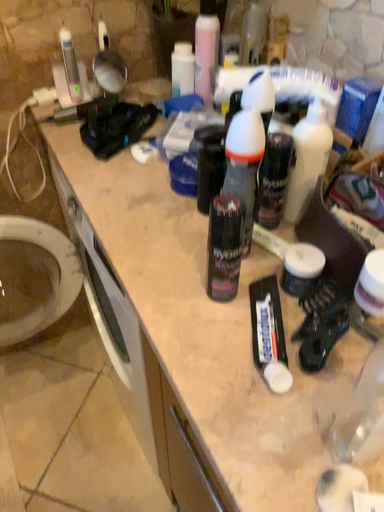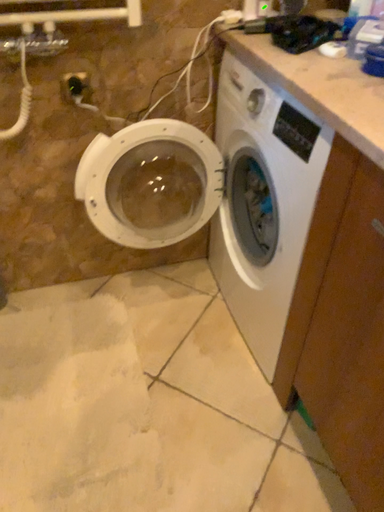
Question: Which way did the camera rotate in the video?

Choices:
 (A) rotated right
 (B) rotated left

Answer: (B)